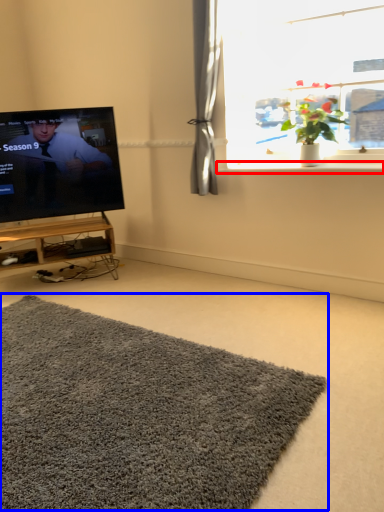
Question: Among these objects, which one is nearest to the camera, window sill (highlighted by a red box) or doormat (highlighted by a blue box)?

Choices:
 (A) window sill
 (B) doormat

Answer: (B)